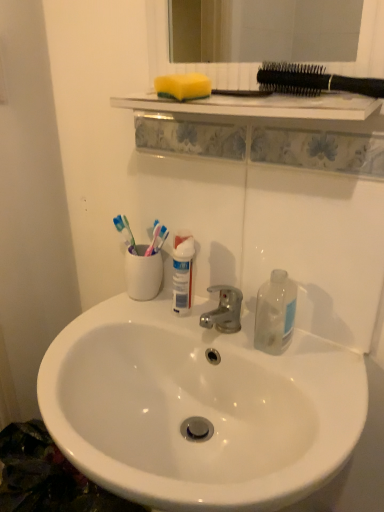
Image resolution: width=384 pixels, height=512 pixels. What do you see at coordinates (183, 86) in the screenshot?
I see `yellow sponge at upper center` at bounding box center [183, 86].

This screenshot has height=512, width=384. I want to click on white glossy sink at center, so click(x=198, y=408).

I want to click on black plastic toothbrushes at upper right, so click(x=313, y=81).

I want to click on yellow sponge at upper center, so click(x=183, y=86).

Looking at this image, does white glossy sink at center have a greater height compared to white ceramic toothbrush holder at center?

Correct, white glossy sink at center is much taller as white ceramic toothbrush holder at center.

Can you confirm if white glossy sink at center is bigger than white ceramic toothbrush holder at center?

Indeed, white glossy sink at center has a larger size compared to white ceramic toothbrush holder at center.

Considering the sizes of white glossy sink at center and white ceramic toothbrush holder at center in the image, is white glossy sink at center wider or thinner than white ceramic toothbrush holder at center?

white glossy sink at center is wider than white ceramic toothbrush holder at center.

Is white glossy sink at center touching white ceramic toothbrush holder at center?

white glossy sink at center is not next to white ceramic toothbrush holder at center, and they're not touching.

Is transparent plastic bottle at right in front of or behind white glossy sink at center in the image?

transparent plastic bottle at right is behind white glossy sink at center.

Considering the sizes of objects transparent plastic bottle at right and white glossy sink at center in the image provided, who is shorter, transparent plastic bottle at right or white glossy sink at center?

transparent plastic bottle at right is shorter.

From the image's perspective, is transparent plastic bottle at right located above white glossy sink at center?

Yes, from the image's perspective, transparent plastic bottle at right is over white glossy sink at center.

In the image, is white ceramic toothbrush holder at center positioned in front of or behind white glossy sink at center?

white ceramic toothbrush holder at center is positioned farther from the viewer than white glossy sink at center.

Is white glossy sink at center at the back of white ceramic toothbrush holder at center?

No, white ceramic toothbrush holder at center is not facing the opposite direction of white glossy sink at center.

From their relative heights in the image, would you say white ceramic toothbrush holder at center is taller or shorter than white glossy sink at center?

Clearly, white ceramic toothbrush holder at center is shorter compared to white glossy sink at center.

Considering the sizes of objects white glossy sink at center and black plastic toothbrushes at upper right in the image provided, who is wider, white glossy sink at center or black plastic toothbrushes at upper right?

With larger width is white glossy sink at center.

Can you confirm if white glossy sink at center is positioned to the left of black plastic toothbrushes at upper right?

Correct, you'll find white glossy sink at center to the left of black plastic toothbrushes at upper right.

Looking at this image, measure the distance from white glossy sink at center to black plastic toothbrushes at upper right.

white glossy sink at center and black plastic toothbrushes at upper right are 20.93 inches apart from each other.

From a real-world perspective, is white glossy sink at center physically above black plastic toothbrushes at upper right?

No, from a real-world perspective, white glossy sink at center is not above black plastic toothbrushes at upper right.

How many degrees apart are the facing directions of black plastic toothbrushes at upper right and transparent plastic bottle at right?

0.599 degrees.

Measure the distance between black plastic toothbrushes at upper right and transparent plastic bottle at right.

black plastic toothbrushes at upper right is 14.43 inches away from transparent plastic bottle at right.

Is black plastic toothbrushes at upper right behind transparent plastic bottle at right?

No, the depth of black plastic toothbrushes at upper right is less than that of transparent plastic bottle at right.

Is black plastic toothbrushes at upper right oriented away from transparent plastic bottle at right?

No, black plastic toothbrushes at upper right's orientation is not away from transparent plastic bottle at right.

From a real-world perspective, is yellow sponge at upper center on black plastic toothbrushes at upper right?

Actually, yellow sponge at upper center is physically below black plastic toothbrushes at upper right in the real world.

What's the angular difference between yellow sponge at upper center and black plastic toothbrushes at upper right's facing directions?

18.6 degrees.

Considering their positions, is yellow sponge at upper center located in front of or behind black plastic toothbrushes at upper right?

yellow sponge at upper center is positioned farther from the viewer than black plastic toothbrushes at upper right.

Based on their sizes in the image, would you say yellow sponge at upper center is bigger or smaller than black plastic toothbrushes at upper right?

Clearly, yellow sponge at upper center is smaller in size than black plastic toothbrushes at upper right.

Consider the image. How far apart are black plastic toothbrushes at upper right and yellow sponge at upper center?

black plastic toothbrushes at upper right and yellow sponge at upper center are 5.57 inches apart.

Would you say black plastic toothbrushes at upper right is to the left or to the right of yellow sponge at upper center in the picture?

In the image, black plastic toothbrushes at upper right appears on the right side of yellow sponge at upper center.

Which is in front, point (311, 83) or point (176, 97)?

The point (311, 83) is closer to the camera.

Based on the photo, can you confirm if black plastic toothbrushes at upper right is taller than yellow sponge at upper center?

Yes.

What are the coordinates of `sink on the right of white ceramic toothbrush holder at center` in the screenshot? It's located at (198, 408).

This screenshot has width=384, height=512. I want to click on sink below the transparent plastic bottle at right (from a real-world perspective), so click(x=198, y=408).

Considering their positions, is black plastic toothbrushes at upper right positioned closer to white ceramic toothbrush holder at center than white glossy sink at center?

white glossy sink at center.

From the image, which object appears to be farther from black plastic toothbrushes at upper right, white glossy sink at center or yellow sponge at upper center?

Based on the image, white glossy sink at center appears to be further to black plastic toothbrushes at upper right.

From the picture: When comparing their distances from white ceramic toothbrush holder at center, does black plastic toothbrushes at upper right or yellow sponge at upper center seem closer?

Among the two, yellow sponge at upper center is located nearer to white ceramic toothbrush holder at center.

When comparing their distances from yellow sponge at upper center, does black plastic toothbrushes at upper right or white glossy sink at center seem further?

white glossy sink at center is further to yellow sponge at upper center.

Considering their positions, is white ceramic toothbrush holder at center positioned further to white glossy sink at center than transparent plastic bottle at right?

white ceramic toothbrush holder at center.

From the image, which object appears to be nearer to white ceramic toothbrush holder at center, transparent plastic bottle at right or yellow sponge at upper center?

transparent plastic bottle at right.

Which object lies nearer to the anchor point black plastic toothbrushes at upper right, transparent plastic bottle at right or white ceramic toothbrush holder at center?

Among the two, transparent plastic bottle at right is located nearer to black plastic toothbrushes at upper right.

Looking at the image, which one is located closer to white ceramic toothbrush holder at center, white glossy sink at center or yellow sponge at upper center?

Based on the image, white glossy sink at center appears to be nearer to white ceramic toothbrush holder at center.

Where is `coffee cup between black plastic toothbrushes at upper right and white glossy sink at center from top to bottom`? Image resolution: width=384 pixels, height=512 pixels. coffee cup between black plastic toothbrushes at upper right and white glossy sink at center from top to bottom is located at coordinates (143, 273).

Locate an element on the screen. coffee cup between yellow sponge at upper center and transparent plastic bottle at right in the up-down direction is located at coordinates (143, 273).

This screenshot has width=384, height=512. I want to click on coffee cup between yellow sponge at upper center and white glossy sink at center in the vertical direction, so click(x=143, y=273).

Find the location of a particular element. bottle between white ceramic toothbrush holder at center and white glossy sink at center in the up-down direction is located at coordinates (275, 313).